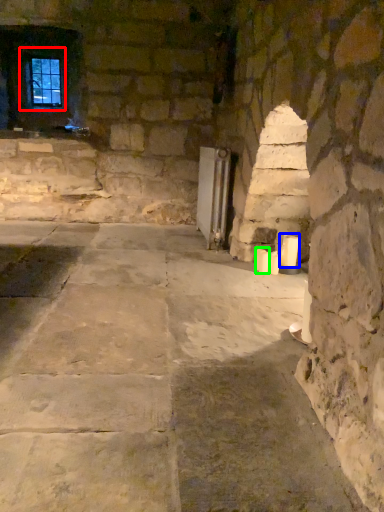
Question: Based on their relative distances, which object is farther from window (highlighted by a red box)? Choose from candle (highlighted by a blue box) and candle (highlighted by a green box).

Choices:
 (A) candle
 (B) candle

Answer: (A)